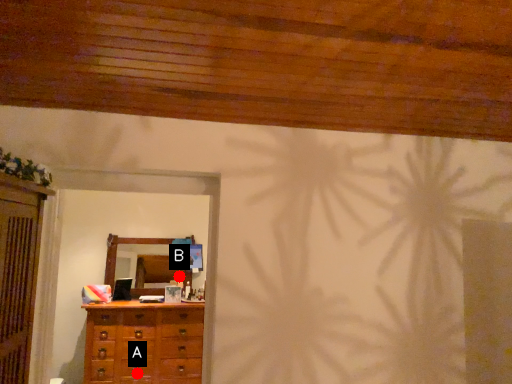
Question: Two points are circled on the image, labeled by A and B beside each circle. Which point is closer to the camera?

Choices:
 (A) A is closer
 (B) B is closer

Answer: (A)